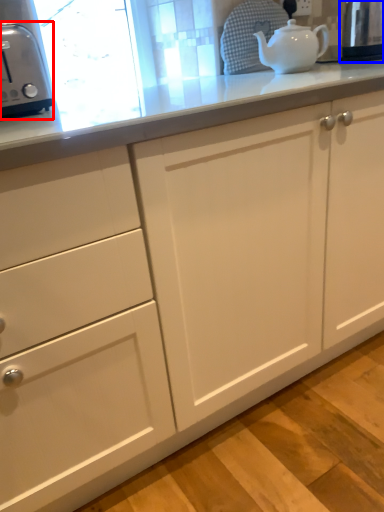
Question: Which object appears closest to the camera in this image, toaster (highlighted by a red box) or appliance (highlighted by a blue box)?

Choices:
 (A) toaster
 (B) appliance

Answer: (A)